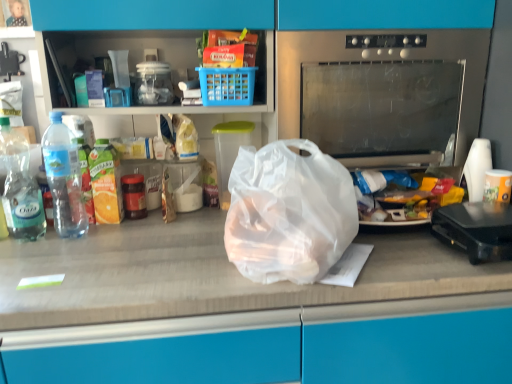
At what (x,y) coordinates should I click in order to perform the action: click on vacant area that lies to the right of clear plastic bottle at left, which is counted as the second bottle, starting from the left. Please return your answer as a coordinate pair (x, y). Image resolution: width=512 pixels, height=384 pixels. Looking at the image, I should click on (128, 236).